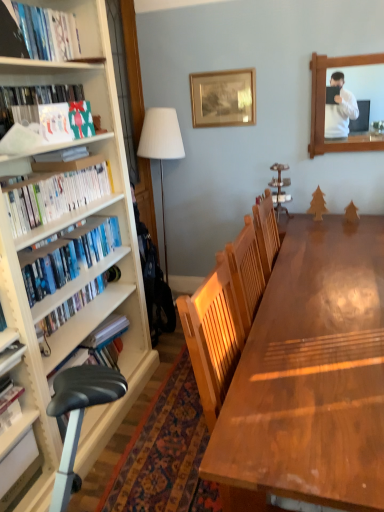
Question: From a real-world perspective, is blue matte bookshelf at left, which is the fourth book in top-to-bottom order, physically located above or below wooden frame at upper right?

Choices:
 (A) below
 (B) above

Answer: (A)

Question: Is blue matte bookshelf at left, which is the fourth book in top-to-bottom order, spatially inside wooden frame at upper right, or outside of it?

Choices:
 (A) outside
 (B) inside

Answer: (A)

Question: Which is farther from the shiny brown wooden table at center?

Choices:
 (A) hardcover book at upper left, marked as the first book in a top-to-bottom arrangement
 (B) blue matte bookshelf at left, arranged as the second book when ordered from the bottom
 (C) matte green gift bag at left, the second book in the top-to-bottom sequence
 (D) wooden frame at upper right
 (E) white glossy bookshelf at left, the third book ordered from the bottom

Answer: (D)

Question: Considering the real-world distances, which object is closest to the hardcover book at upper left, marked as the first book in a top-to-bottom arrangement?

Choices:
 (A) white fabric lampshade at left
 (B) blue matte bookshelf at left, arranged as the second book when ordered from the bottom
 (C) matte green gift bag at left, which ranks as the fourth book in bottom-to-top order
 (D) hardcover book at left, which is counted as the 1th book, starting from the bottom
 (E) shiny brown wooden table at center

Answer: (C)